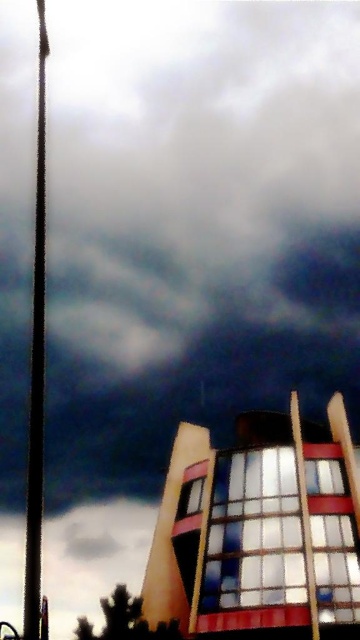
Question: Is metallic pole at left further to camera compared to wooden flag pole at right?

Choices:
 (A) no
 (B) yes

Answer: (A)

Question: Can you confirm if metallic pole at left is positioned to the right of wooden flag pole at right?

Choices:
 (A) yes
 (B) no

Answer: (B)

Question: Which of the following is the farthest from the observer?

Choices:
 (A) metallic pole at left
 (B) wooden flag pole at right

Answer: (B)

Question: Which object is closer to the camera taking this photo?

Choices:
 (A) wooden flag pole at right
 (B) metallic pole at left

Answer: (B)

Question: Can you confirm if metallic pole at left is positioned to the right of wooden flag pole at right?

Choices:
 (A) no
 (B) yes

Answer: (A)